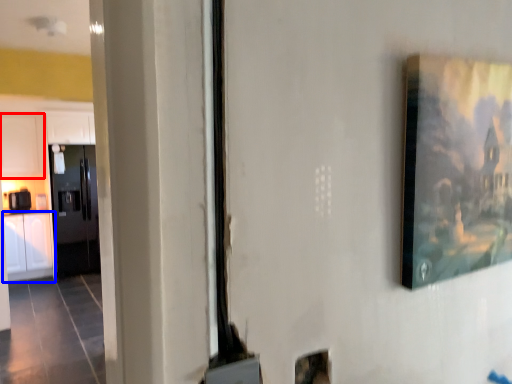
Question: Which object appears closest to the camera in this image, cabinetry (highlighted by a red box) or cabinetry (highlighted by a blue box)?

Choices:
 (A) cabinetry
 (B) cabinetry

Answer: (B)